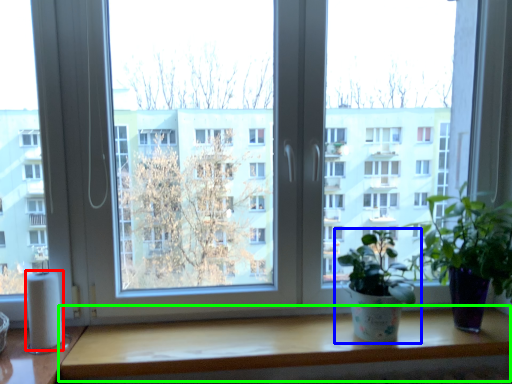
Question: Estimate the real-world distances between objects in this image. Which object is closer to toilet paper (highlighted by a red box), houseplant (highlighted by a blue box) or table (highlighted by a green box)?

Choices:
 (A) houseplant
 (B) table

Answer: (B)